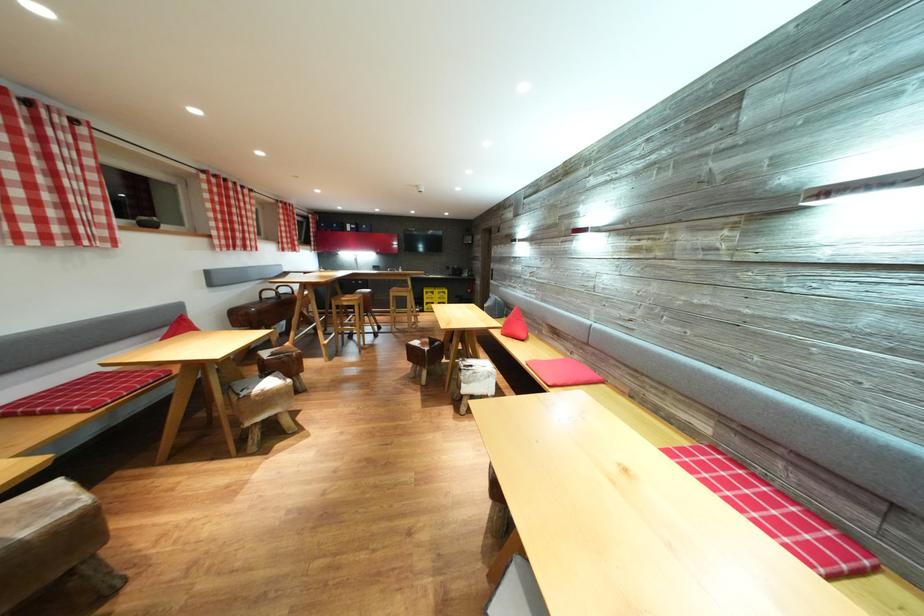
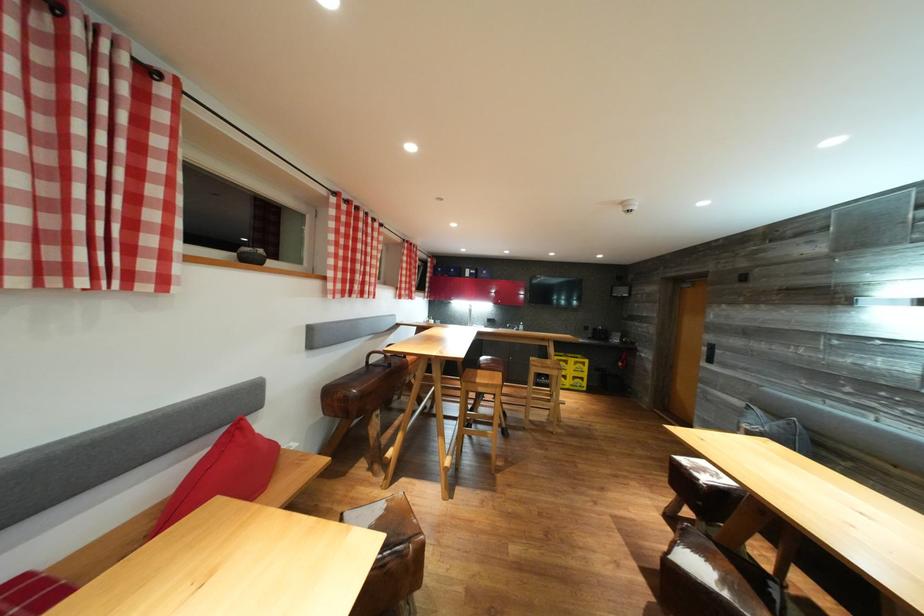
Find the pixel in the second image that matches (x=67, y=248) in the first image.

(23, 286)